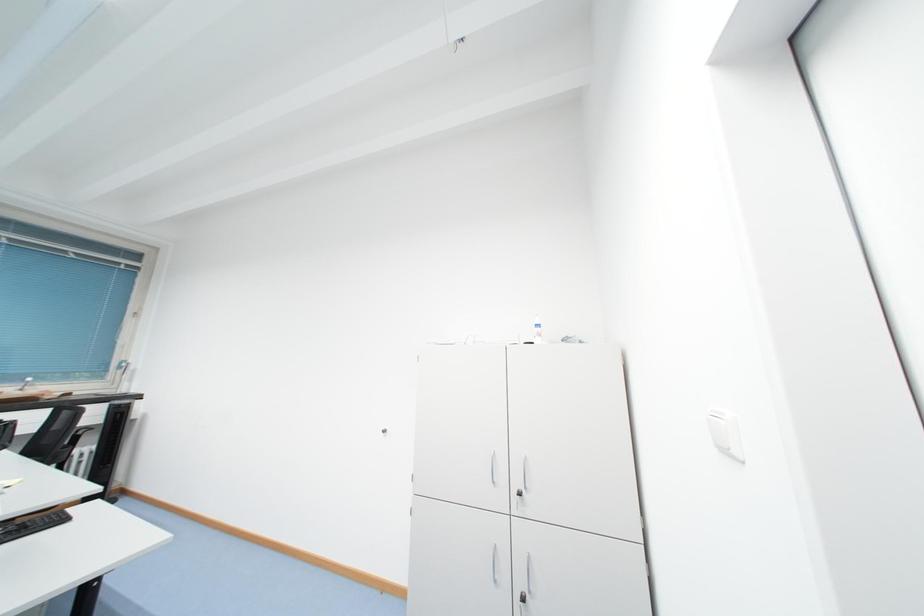
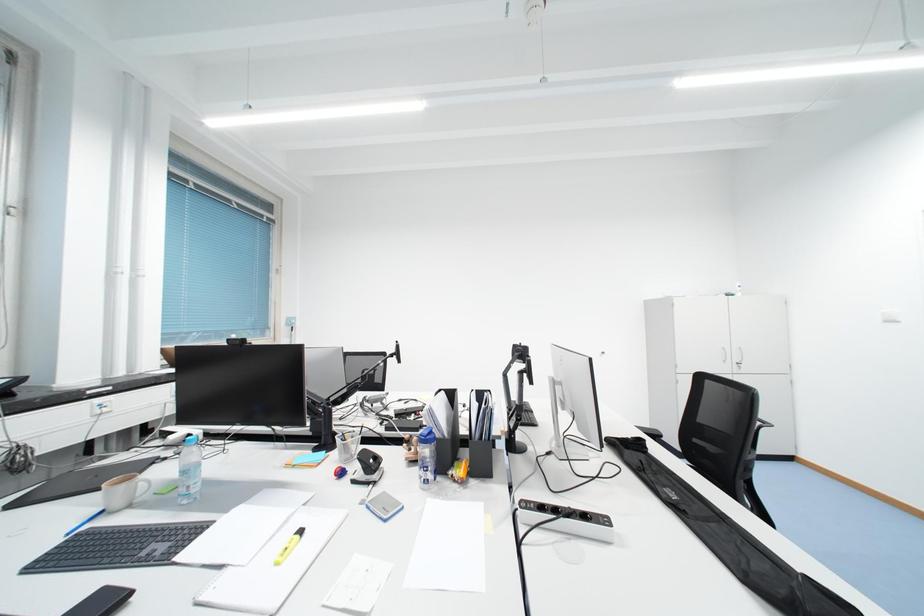
Question: What movement of the cameraman would produce the second image?

Choices:
 (A) Left
 (B) Right
 (C) Forward
 (D) Backward

Answer: (A)